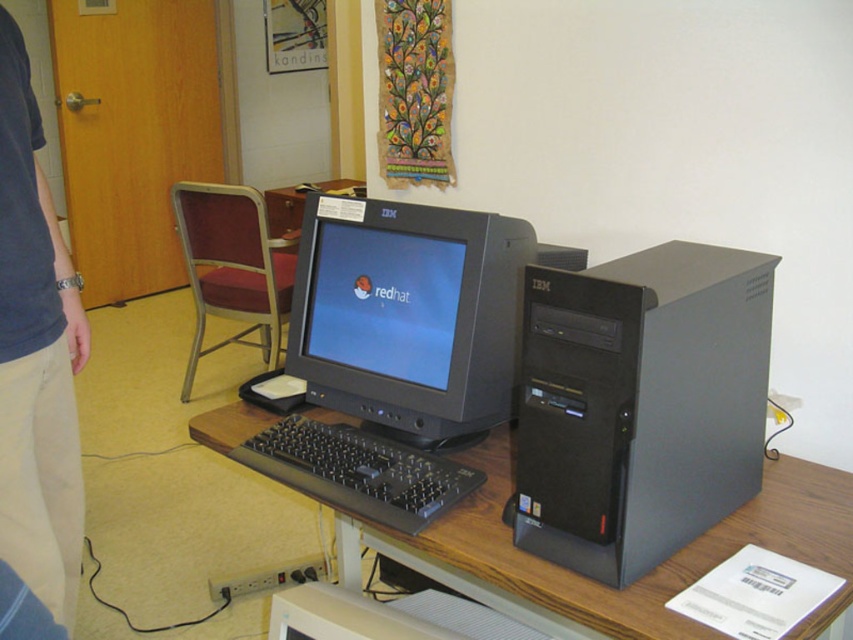
What object is located at the coordinates point (639, 404)?

The point (639, 404) corresponds to the black plastic computer tower at center right.

You are organizing a desk and need to place the blue denim shirt at left and the matte plastic monitor at center. Given their sizes, which object should you place first to ensure enough space?

The blue denim shirt at left is much taller than the matte plastic monitor at center, so you should place the blue denim shirt at left first to ensure there is enough vertical space for it on the desk.